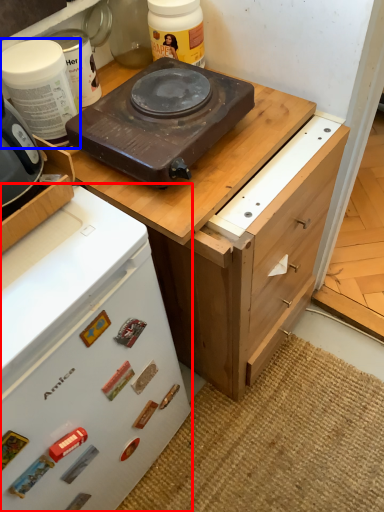
Question: Which object appears closest to the camera in this image, home appliance (highlighted by a red box) or kitchen appliance (highlighted by a blue box)?

Choices:
 (A) home appliance
 (B) kitchen appliance

Answer: (A)